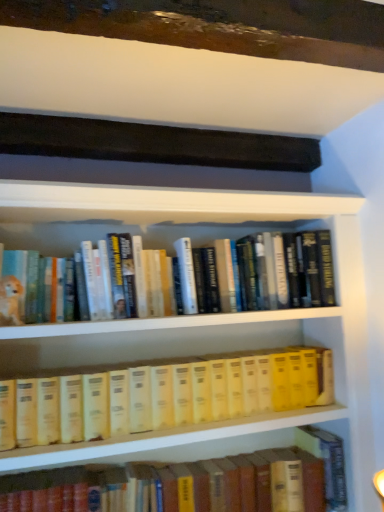
The image size is (384, 512). What do you see at coordinates (192, 483) in the screenshot? I see `hardcover book at center, which is the 1th book in bottom-to-top order` at bounding box center [192, 483].

Image resolution: width=384 pixels, height=512 pixels. Find the location of `hardcover book at center, the second book from the top`. hardcover book at center, the second book from the top is located at coordinates (192, 483).

Measure the distance between point (18, 430) and camera.

They are 3.47 feet apart.

Find the location of a particular element. The height and width of the screenshot is (512, 384). yellow hardcover books at center, which is counted as the second book, starting from the bottom is located at coordinates (161, 396).

Image resolution: width=384 pixels, height=512 pixels. What do you see at coordinates (161, 396) in the screenshot? I see `yellow hardcover books at center, the first book positioned from the top` at bounding box center [161, 396].

The height and width of the screenshot is (512, 384). I want to click on hardcover book at center, which is the 1th book in bottom-to-top order, so click(192, 483).

Is yellow hardcover books at center, the first book positioned from the top, to the left or to the right of hardcover book at center, the second book from the top, in the image?

From the image, it's evident that yellow hardcover books at center, the first book positioned from the top, is to the left of hardcover book at center, the second book from the top.

Which object is closer to the camera, yellow hardcover books at center, which is counted as the second book, starting from the bottom, or hardcover book at center, which is the 1th book in bottom-to-top order?

Positioned in front is yellow hardcover books at center, which is counted as the second book, starting from the bottom.

Does point (160, 399) lie in front of point (211, 476)?

That is True.

From the image's perspective, is yellow hardcover books at center, which is counted as the second book, starting from the bottom, above or below hardcover book at center, which is the 1th book in bottom-to-top order?

Based on their image positions, yellow hardcover books at center, which is counted as the second book, starting from the bottom, is located above hardcover book at center, which is the 1th book in bottom-to-top order.

From a real-world perspective, is yellow hardcover books at center, the first book positioned from the top, on hardcover book at center, which is the 1th book in bottom-to-top order?

Yes.

Is yellow hardcover books at center, which is counted as the second book, starting from the bottom, thinner than hardcover book at center, which is the 1th book in bottom-to-top order?

In fact, yellow hardcover books at center, which is counted as the second book, starting from the bottom, might be wider than hardcover book at center, which is the 1th book in bottom-to-top order.

Looking at this image, considering the relative sizes of yellow hardcover books at center, which is counted as the second book, starting from the bottom, and hardcover book at center, the second book from the top, in the image provided, is yellow hardcover books at center, which is counted as the second book, starting from the bottom, shorter than hardcover book at center, the second book from the top,?

Yes.

Consider the image. Considering the relative sizes of yellow hardcover books at center, the first book positioned from the top, and hardcover book at center, which is the 1th book in bottom-to-top order, in the image provided, is yellow hardcover books at center, the first book positioned from the top, smaller than hardcover book at center, which is the 1th book in bottom-to-top order,?

No, yellow hardcover books at center, the first book positioned from the top, is not smaller than hardcover book at center, which is the 1th book in bottom-to-top order.

Is hardcover book at center, the second book from the top, surrounded by yellow hardcover books at center, the first book positioned from the top?

No, hardcover book at center, the second book from the top, is located outside of yellow hardcover books at center, the first book positioned from the top.

Are yellow hardcover books at center, which is counted as the second book, starting from the bottom, and hardcover book at center, which is the 1th book in bottom-to-top order, far apart?

No, yellow hardcover books at center, which is counted as the second book, starting from the bottom, is in close proximity to hardcover book at center, which is the 1th book in bottom-to-top order.

Is yellow hardcover books at center, the first book positioned from the top, oriented away from hardcover book at center, the second book from the top?

That's not correct — yellow hardcover books at center, the first book positioned from the top, is not looking away from hardcover book at center, the second book from the top.

What's the angular difference between yellow hardcover books at center, the first book positioned from the top, and hardcover book at center, the second book from the top,'s facing directions?

yellow hardcover books at center, the first book positioned from the top, and hardcover book at center, the second book from the top, are facing 2.18 degrees away from each other.

How far apart are yellow hardcover books at center, the first book positioned from the top, and hardcover book at center, the second book from the top?

yellow hardcover books at center, the first book positioned from the top, is 8.86 inches from hardcover book at center, the second book from the top.

Locate an element on the screen. book in front of the hardcover book at center, which is the 1th book in bottom-to-top order is located at coordinates (161, 396).

Between hardcover book at center, the second book from the top, and yellow hardcover books at center, which is counted as the second book, starting from the bottom, which one appears on the left side from the viewer's perspective?

From the viewer's perspective, yellow hardcover books at center, which is counted as the second book, starting from the bottom, appears more on the left side.

Which is behind, hardcover book at center, the second book from the top, or yellow hardcover books at center, the first book positioned from the top?

hardcover book at center, the second book from the top, is behind.

Does point (137, 493) come closer to viewer compared to point (21, 445)?

No, (137, 493) is further to viewer.

From the picture: From the image's perspective, is hardcover book at center, the second book from the top, on top of yellow hardcover books at center, which is counted as the second book, starting from the bottom?

No.

From a real-world perspective, which is physically above, hardcover book at center, which is the 1th book in bottom-to-top order, or yellow hardcover books at center, which is counted as the second book, starting from the bottom?

yellow hardcover books at center, which is counted as the second book, starting from the bottom, from a real-world perspective.

Looking at this image, considering the relative sizes of hardcover book at center, the second book from the top, and yellow hardcover books at center, which is counted as the second book, starting from the bottom, in the image provided, is hardcover book at center, the second book from the top, thinner than yellow hardcover books at center, which is counted as the second book, starting from the bottom,?

Yes.

From the picture: Considering the relative sizes of hardcover book at center, the second book from the top, and yellow hardcover books at center, which is counted as the second book, starting from the bottom, in the image provided, is hardcover book at center, the second book from the top, taller than yellow hardcover books at center, which is counted as the second book, starting from the bottom,?

Indeed, hardcover book at center, the second book from the top, has a greater height compared to yellow hardcover books at center, which is counted as the second book, starting from the bottom.

Who is bigger, hardcover book at center, which is the 1th book in bottom-to-top order, or yellow hardcover books at center, the first book positioned from the top?

Bigger between the two is yellow hardcover books at center, the first book positioned from the top.

Is yellow hardcover books at center, which is counted as the second book, starting from the bottom, inside hardcover book at center, the second book from the top?

No, yellow hardcover books at center, which is counted as the second book, starting from the bottom, is not inside hardcover book at center, the second book from the top.

Is hardcover book at center, the second book from the top, beside yellow hardcover books at center, which is counted as the second book, starting from the bottom?

No, hardcover book at center, the second book from the top, is not next to yellow hardcover books at center, which is counted as the second book, starting from the bottom.

Is hardcover book at center, which is the 1th book in bottom-to-top order, positioned with its back to yellow hardcover books at center, the first book positioned from the top?

No, hardcover book at center, which is the 1th book in bottom-to-top order, is not facing the opposite direction of yellow hardcover books at center, the first book positioned from the top.

Locate an element on the screen. The image size is (384, 512). book in front of the hardcover book at center, which is the 1th book in bottom-to-top order is located at coordinates (161, 396).

Where is `book below the yellow hardcover books at center, which is counted as the second book, starting from the bottom (from the image's perspective)`? This screenshot has width=384, height=512. book below the yellow hardcover books at center, which is counted as the second book, starting from the bottom (from the image's perspective) is located at coordinates (192, 483).

The height and width of the screenshot is (512, 384). I want to click on book located on the right of yellow hardcover books at center, which is counted as the second book, starting from the bottom, so click(192, 483).